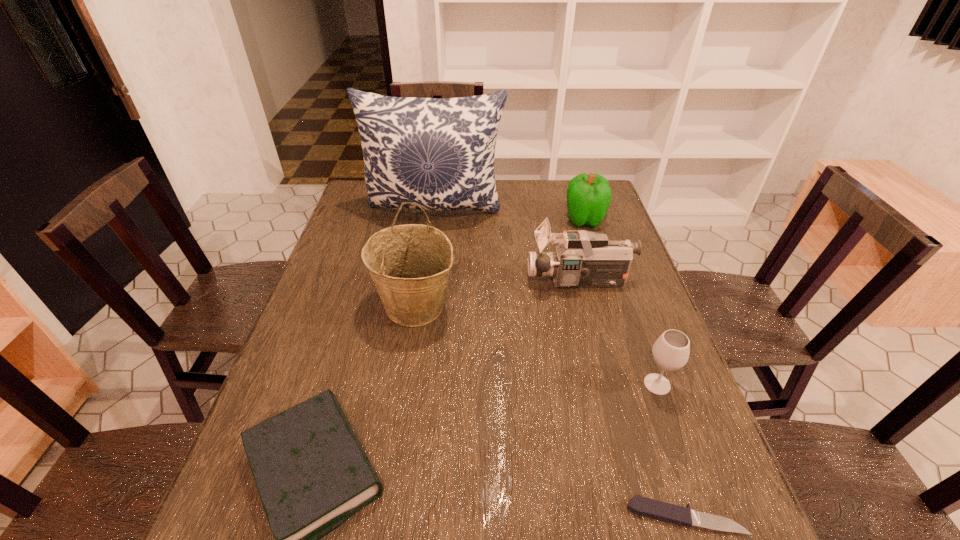
At what (x,y) coordinates should I click in order to perform the action: click on cushion. Please return your answer as a coordinate pair (x, y). Looking at the image, I should click on (438, 153).

This screenshot has width=960, height=540. Find the location of `the second tallest object`. the second tallest object is located at coordinates (409, 264).

The height and width of the screenshot is (540, 960). Identify the location of camcorder. (582, 258).

You are a GUI agent. You are given a task and a screenshot of the screen. Output one action in this format:
    pyautogui.click(x=<x>, y=<y>)
    Task: Click on the bell pepper
    
    Given the screenshot: What is the action you would take?
    pyautogui.click(x=588, y=196)

Image resolution: width=960 pixels, height=540 pixels. Identify the location of the fifth farthest object. (670, 352).

I want to click on the shortest object, so click(x=658, y=510).

At what (x,y) coordinates should I click in order to perform the action: click on free point located on the front surface of the cushion. Please return your answer as a coordinate pair (x, y). This screenshot has width=960, height=540. Looking at the image, I should click on (426, 279).

You are a GUI agent. You are given a task and a screenshot of the screen. Output one action in this format:
    pyautogui.click(x=<x>, y=<y>)
    Task: Click on the free space located 0.120m on the front of the wine bucket
    This screenshot has width=960, height=540.
    Given the screenshot: What is the action you would take?
    pyautogui.click(x=404, y=377)

This screenshot has width=960, height=540. Find the location of `vacant point located 0.140m on the front-facing side of the camcorder`. vacant point located 0.140m on the front-facing side of the camcorder is located at coordinates (479, 281).

Identify the location of free space located 0.370m on the front-facing side of the camcorder. (398, 281).